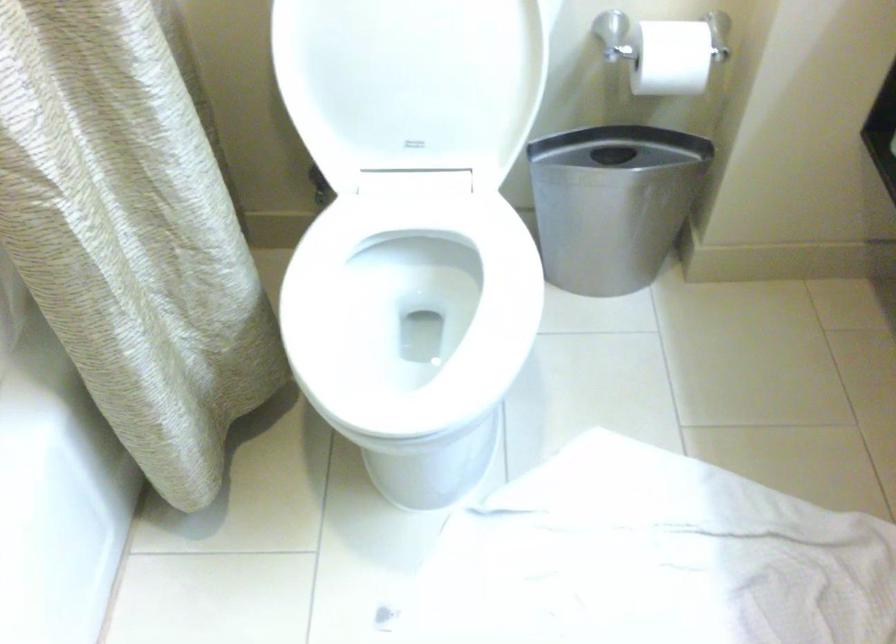
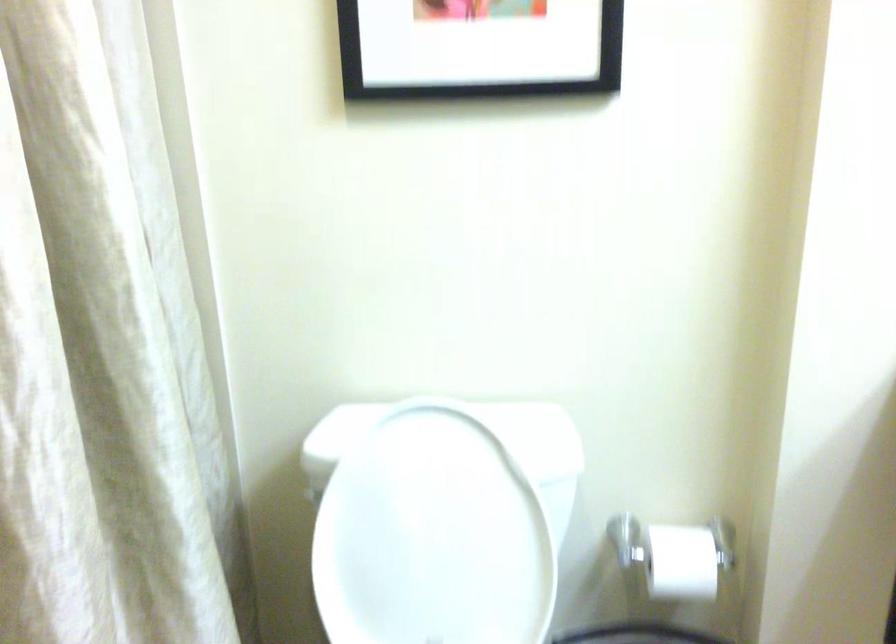
Question: How did the camera likely rotate?

Choices:
 (A) Left
 (B) Right
 (C) Up
 (D) Down

Answer: (C)